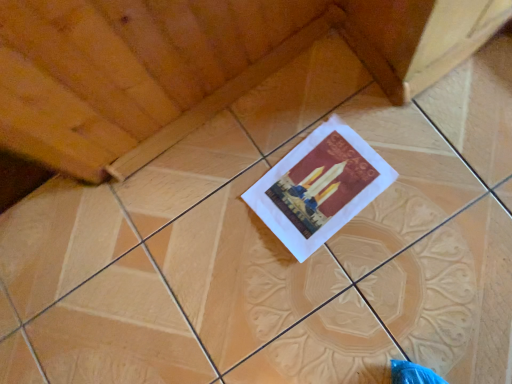
Find the location of a particular element. vacant space in front of matte paper postcard at center is located at coordinates (388, 264).